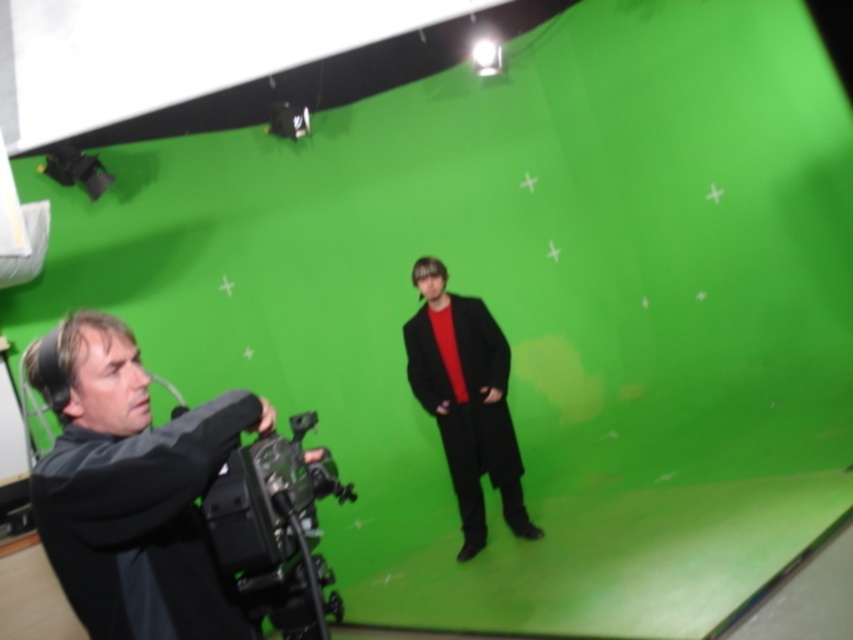
This screenshot has height=640, width=853. Identify the location of black plastic video camera at lower left. (276, 531).

Is black plastic video camera at lower left smaller than matte black coat at center?

Correct, black plastic video camera at lower left occupies less space than matte black coat at center.

Is point (254, 573) closer to viewer compared to point (471, 506)?

Yes.

Identify the location of black plastic video camera at lower left. The width and height of the screenshot is (853, 640). (276, 531).

This screenshot has width=853, height=640. Describe the element at coordinates (131, 488) in the screenshot. I see `dark gray fabric camera at lower left` at that location.

Who is positioned more to the right, dark gray fabric camera at lower left or black plastic video camera at lower left?

From the viewer's perspective, black plastic video camera at lower left appears more on the right side.

Where is `dark gray fabric camera at lower left`? The height and width of the screenshot is (640, 853). dark gray fabric camera at lower left is located at coordinates (131, 488).

This screenshot has height=640, width=853. Identify the location of dark gray fabric camera at lower left. (131, 488).

Between point (36, 465) and point (474, 369), which one is positioned in front?

Point (36, 465)

Which of these two, dark gray fabric camera at lower left or matte black coat at center, stands taller?

Standing taller between the two is matte black coat at center.

Who is more distant from viewer, (144, 472) or (488, 390)?

Positioned behind is point (488, 390).

Locate an element on the screen. This screenshot has width=853, height=640. dark gray fabric camera at lower left is located at coordinates (131, 488).